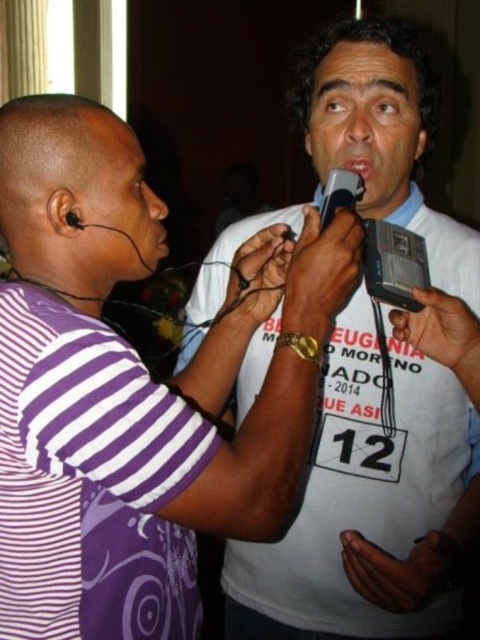
You are organizing a small event and need to decide which item to place in a storage box that can only hold items smaller than the white fabric shirt at center. Can the black plastic microphone at center fit in the box?

The black plastic microphone at center is smaller than the white fabric shirt at center, so it can fit in the storage box designed for items smaller than the white fabric shirt at center.